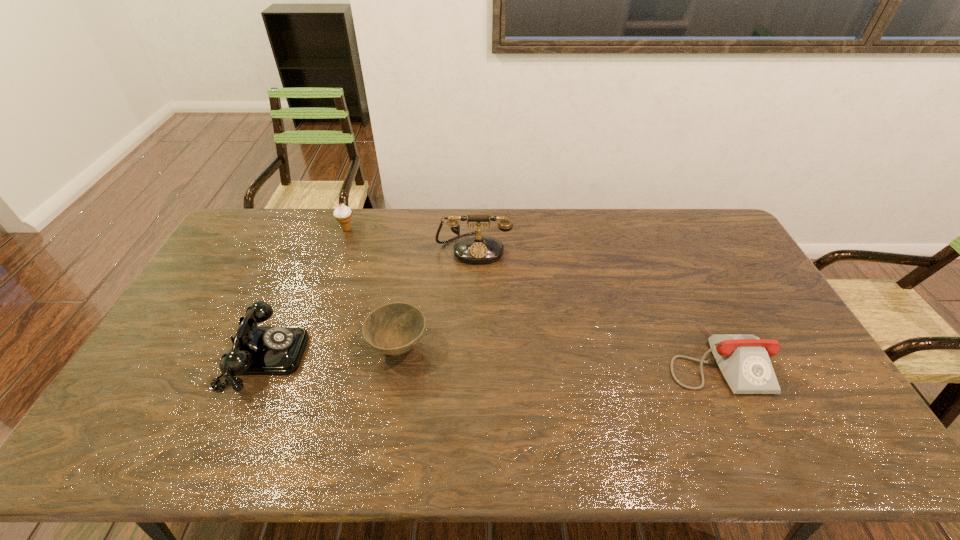
Find the location of `the farthest telephone`. the farthest telephone is located at coordinates (478, 249).

Where is `the second telephone from right to left`? This screenshot has width=960, height=540. the second telephone from right to left is located at coordinates (478, 249).

The height and width of the screenshot is (540, 960). I want to click on icecream, so click(343, 214).

Image resolution: width=960 pixels, height=540 pixels. Find the location of `the second shortest telephone`. the second shortest telephone is located at coordinates tap(256, 350).

This screenshot has width=960, height=540. I want to click on bowl, so click(395, 328).

The height and width of the screenshot is (540, 960). What are the coordinates of `the rightmost telephone` in the screenshot? It's located at (743, 359).

Image resolution: width=960 pixels, height=540 pixels. What are the coordinates of `the shortest telephone` in the screenshot? It's located at (743, 359).

Where is `free region located on the dial of the farthest telephone`? free region located on the dial of the farthest telephone is located at coordinates (473, 305).

Locate an element on the screen. free space located 0.180m on the left of the icecream is located at coordinates (290, 230).

This screenshot has height=540, width=960. In order to click on vacant space situated on the dial of the second shortest telephone in this screenshot , I will do `click(428, 356)`.